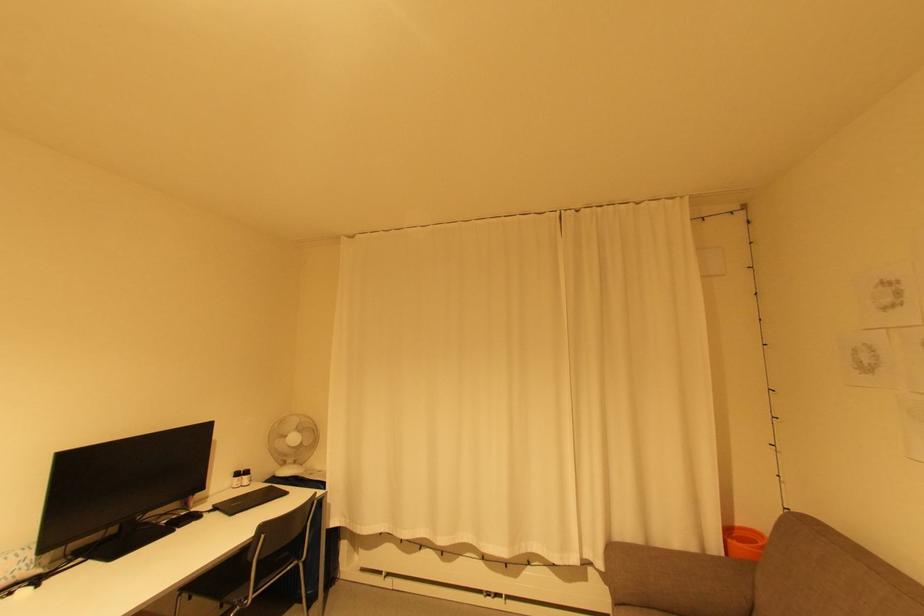
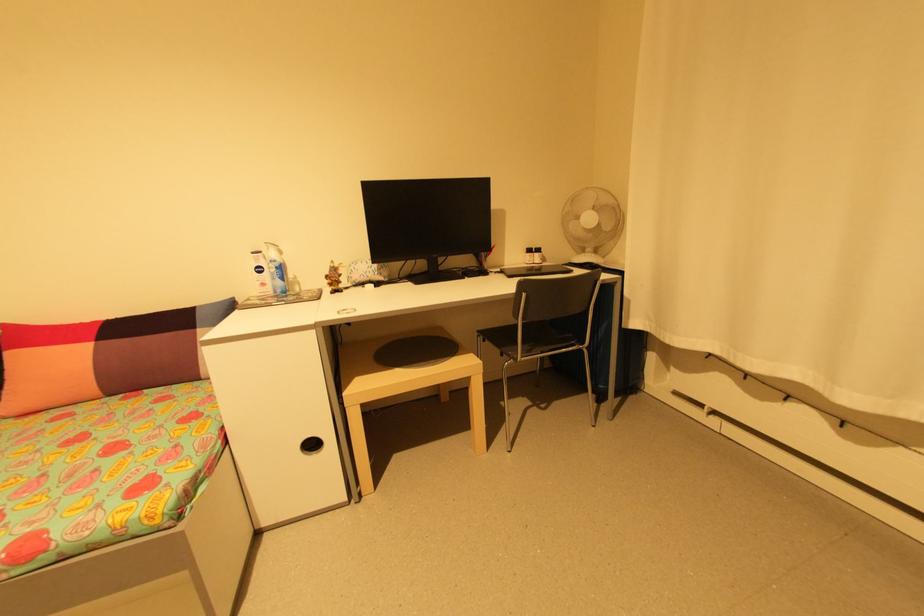
In the second image, find the point that corresponds to (x=466, y=557) in the first image.

(906, 448)